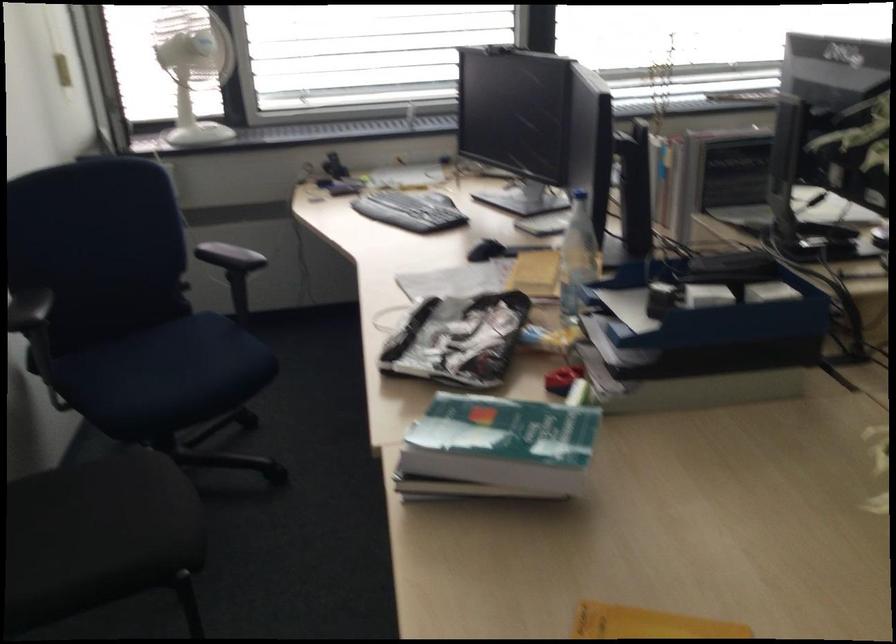
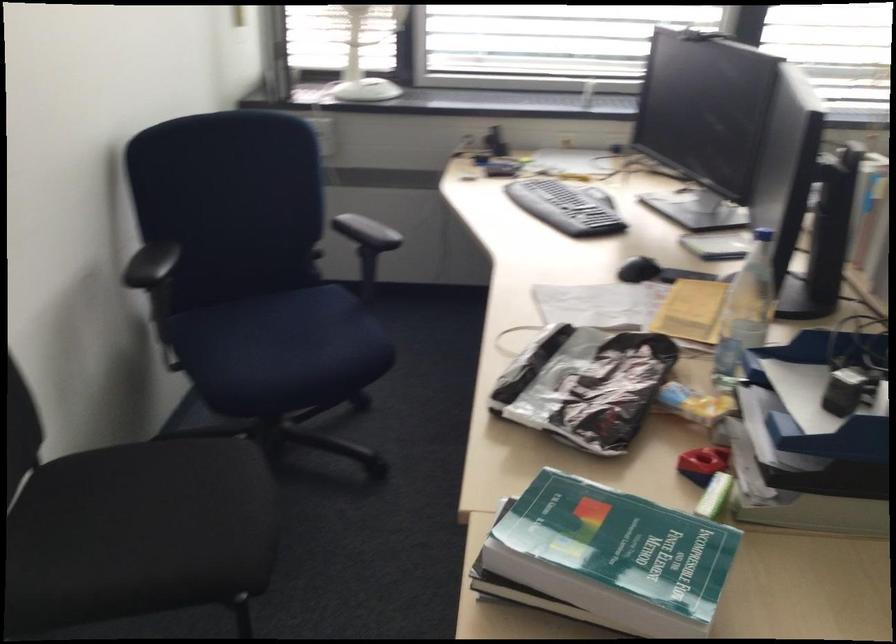
Where in the second image is the point corresponding to (x=640, y=308) from the first image?

(819, 395)